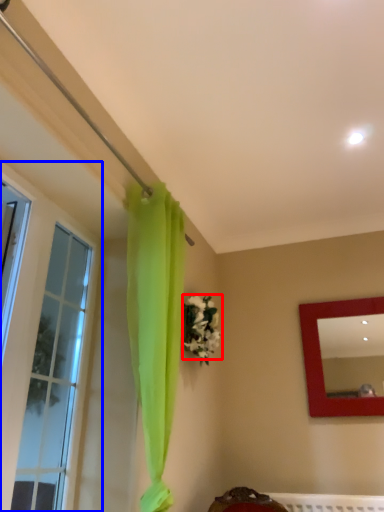
Question: Which object appears farthest to the camera in this image, flower (highlighted by a red box) or window (highlighted by a blue box)?

Choices:
 (A) flower
 (B) window

Answer: (A)